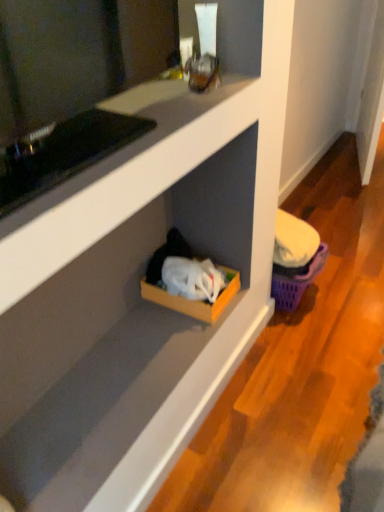
Find the location of a particular element. This screenshot has height=512, width=384. free point in front of wooden cardboard box at lower center is located at coordinates (168, 347).